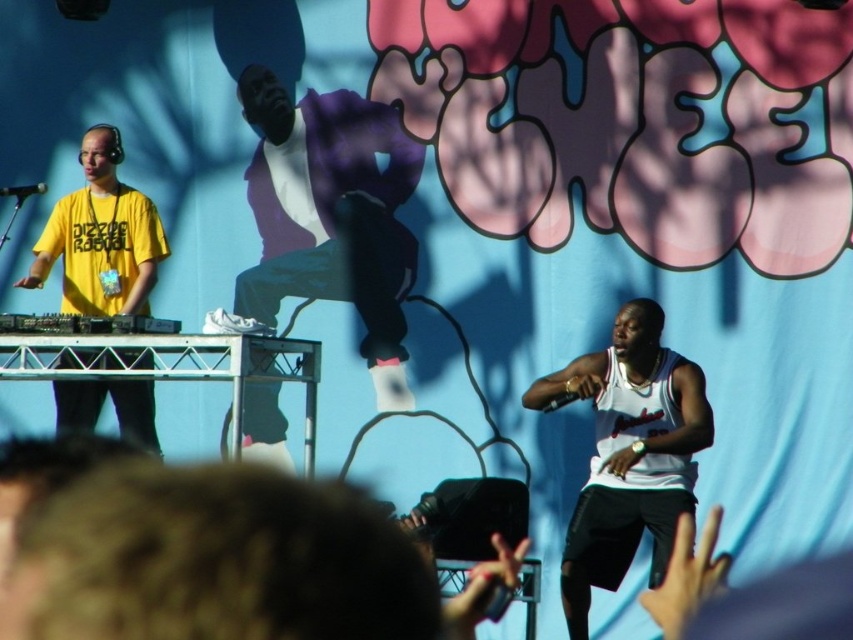
You are a photographer at the music event and need to capture both the purple cotton jacket at center and the white jersey at center in a single frame. Which clothing item will appear bigger in your photo?

The purple cotton jacket at center will appear bigger in the photo because it has a larger size compared to the white jersey at center.

Based on the photo, you are standing at the point marked as point [653,317] in the image. The DJ booth is to your left, and the performer is to your right. If you want to move closer to the stage, which direction should you walk?

Since the point [653,317] is 9.34 meters away from the viewer, moving towards the stage would require walking forward towards the DJ booth and performer, as they are positioned in front of you.